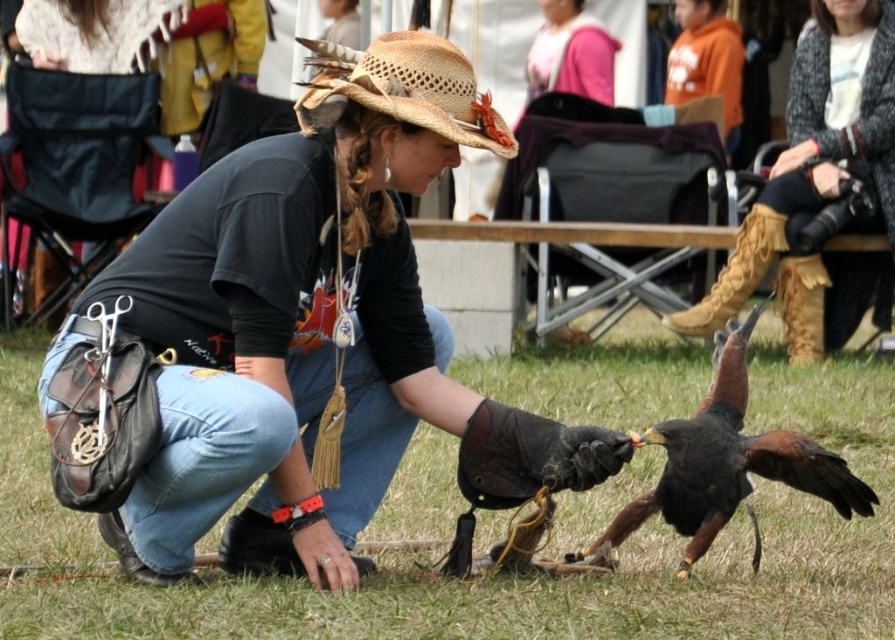
Question: From the image, what is the correct spatial relationship of brown feathered falcon at lower right in relation to matte pink sweater at upper center?

Choices:
 (A) right
 (B) left

Answer: (B)

Question: Which of the following is the closest to the observer?

Choices:
 (A) matte pink sweater at upper center
 (B) straw hat at center
 (C) brown feathered falcon at lower right

Answer: (B)

Question: Which object appears closest to the camera in this image?

Choices:
 (A) straw hat at center
 (B) matte pink sweater at upper center
 (C) brown feathered falcon at lower right
 (D) matte black shirt at center

Answer: (D)

Question: Does straw hat at center have a greater width compared to matte pink sweater at upper center?

Choices:
 (A) yes
 (B) no

Answer: (B)

Question: Does brown feathered falcon at lower right appear on the right side of matte pink sweater at upper center?

Choices:
 (A) no
 (B) yes

Answer: (A)

Question: Estimate the real-world distances between objects in this image. Which object is closer to the brown feathered falcon at lower right?

Choices:
 (A) straw hat at center
 (B) matte black shirt at center
 (C) leather fringe boots at lower right

Answer: (B)